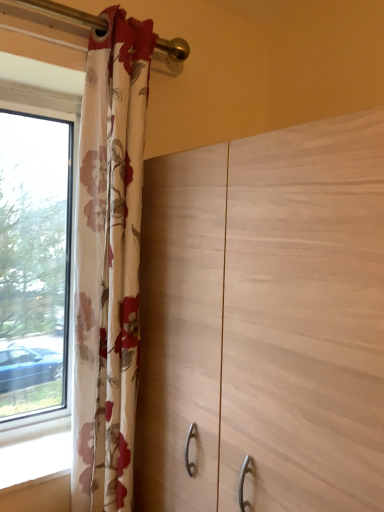
Question: Can you confirm if floral fabric curtain at left is positioned to the left of light wood dresser at center?

Choices:
 (A) yes
 (B) no

Answer: (A)

Question: Does floral fabric curtain at left have a greater height compared to light wood dresser at center?

Choices:
 (A) yes
 (B) no

Answer: (A)

Question: Considering the relative sizes of floral fabric curtain at left and light wood dresser at center in the image provided, is floral fabric curtain at left bigger than light wood dresser at center?

Choices:
 (A) yes
 (B) no

Answer: (B)

Question: Is light wood dresser at center surrounded by floral fabric curtain at left?

Choices:
 (A) yes
 (B) no

Answer: (B)

Question: Is floral fabric curtain at left shorter than light wood dresser at center?

Choices:
 (A) no
 (B) yes

Answer: (A)

Question: From a real-world perspective, is floral fabric curtain at left on top of light wood dresser at center?

Choices:
 (A) yes
 (B) no

Answer: (A)

Question: Can you confirm if light wood dresser at center is thinner than floral fabric curtain at left?

Choices:
 (A) no
 (B) yes

Answer: (A)

Question: Is light wood dresser at center to the right of floral fabric curtain at left from the viewer's perspective?

Choices:
 (A) yes
 (B) no

Answer: (A)

Question: Can you confirm if light wood dresser at center is wider than floral fabric curtain at left?

Choices:
 (A) no
 (B) yes

Answer: (B)

Question: Is light wood dresser at center completely or partially outside of floral fabric curtain at left?

Choices:
 (A) no
 (B) yes

Answer: (B)

Question: From the image's perspective, is light wood dresser at center under floral fabric curtain at left?

Choices:
 (A) yes
 (B) no

Answer: (A)

Question: Is light wood dresser at center at the left side of floral fabric curtain at left?

Choices:
 (A) no
 (B) yes

Answer: (A)

Question: Do you think floral fabric curtain at left is within light wood dresser at center, or outside of it?

Choices:
 (A) outside
 (B) inside

Answer: (A)